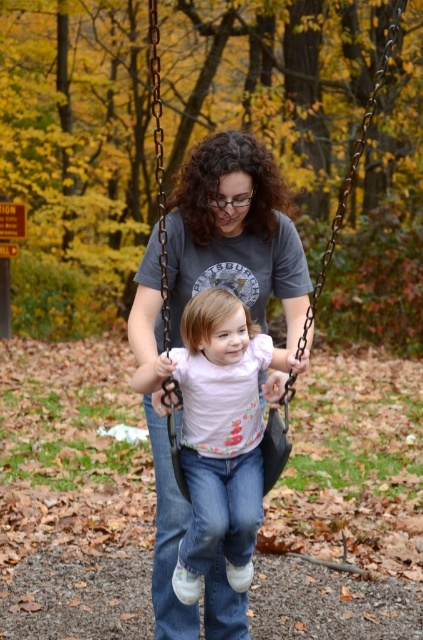
Does gray cotton shirt at center have a smaller size compared to metallic chain swing at center?

Yes, gray cotton shirt at center is smaller than metallic chain swing at center.

Does gray cotton shirt at center have a larger size compared to metallic chain swing at center?

Incorrect, gray cotton shirt at center is not larger than metallic chain swing at center.

Does point (142, 266) lie in front of point (277, 436)?

That is False.

This screenshot has width=423, height=640. Find the location of `gray cotton shirt at center`. gray cotton shirt at center is located at coordinates (235, 232).

Is gray cotton shirt at center wider than blue denim jeans at center?

Yes, gray cotton shirt at center is wider than blue denim jeans at center.

What do you see at coordinates (235, 232) in the screenshot?
I see `gray cotton shirt at center` at bounding box center [235, 232].

The width and height of the screenshot is (423, 640). Identify the location of gray cotton shirt at center. (235, 232).

Which is more to the right, blue denim jeans at center or metallic chain swing at center?

metallic chain swing at center

Does point (227, 621) lie in front of point (346, 173)?

That is True.

Identify the location of blue denim jeans at center. The image size is (423, 640). (167, 538).